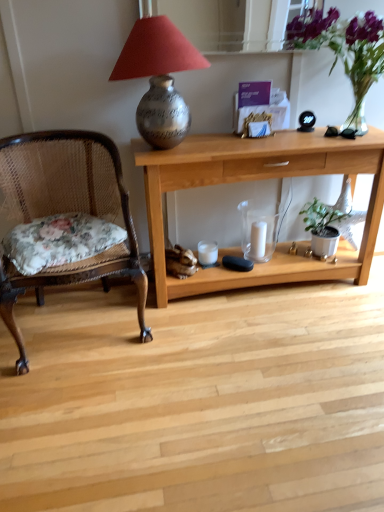
Question: Is white matte candle at center shorter than woven wood chair with floral cushion at left?

Choices:
 (A) yes
 (B) no

Answer: (A)

Question: Does white matte candle at center have a greater height compared to woven wood chair with floral cushion at left?

Choices:
 (A) no
 (B) yes

Answer: (A)

Question: Does white matte candle at center have a lesser width compared to woven wood chair with floral cushion at left?

Choices:
 (A) yes
 (B) no

Answer: (A)

Question: Can you confirm if white matte candle at center is smaller than woven wood chair with floral cushion at left?

Choices:
 (A) no
 (B) yes

Answer: (B)

Question: Is white matte candle at center behind woven wood chair with floral cushion at left?

Choices:
 (A) yes
 (B) no

Answer: (A)

Question: From the image's perspective, is white matte candle at center above or below transparent glass candle holder at center, which ranks as the 2th candle holder in left-to-right order?

Choices:
 (A) below
 (B) above

Answer: (A)

Question: Relative to transparent glass candle holder at center, the 1th candle holder in the right-to-left sequence, is white matte candle at center in front or behind?

Choices:
 (A) front
 (B) behind

Answer: (B)

Question: Considering the positions of white matte candle at center and transparent glass candle holder at center, the 1th candle holder in the right-to-left sequence, in the image, is white matte candle at center taller or shorter than transparent glass candle holder at center, the 1th candle holder in the right-to-left sequence,?

Choices:
 (A) short
 (B) tall

Answer: (A)

Question: From a real-world perspective, is white matte candle at center physically located above or below transparent glass candle holder at center, which ranks as the 2th candle holder in left-to-right order?

Choices:
 (A) above
 (B) below

Answer: (B)

Question: From their relative heights in the image, would you say woven wood chair with floral cushion at left is taller or shorter than green matte plant at lower right?

Choices:
 (A) tall
 (B) short

Answer: (A)

Question: In terms of width, does woven wood chair with floral cushion at left look wider or thinner when compared to green matte plant at lower right?

Choices:
 (A) thin
 (B) wide

Answer: (B)

Question: Is woven wood chair with floral cushion at left to the left or to the right of green matte plant at lower right in the image?

Choices:
 (A) left
 (B) right

Answer: (A)

Question: From a real-world perspective, is woven wood chair with floral cushion at left positioned above or below green matte plant at lower right?

Choices:
 (A) below
 (B) above

Answer: (B)

Question: Relative to transparent glass candle holder at center, the 1th candle holder in the right-to-left sequence, is light wood desk at center in front or behind?

Choices:
 (A) behind
 (B) front

Answer: (B)

Question: From the image's perspective, is light wood desk at center above or below transparent glass candle holder at center, which ranks as the 2th candle holder in left-to-right order?

Choices:
 (A) above
 (B) below

Answer: (A)